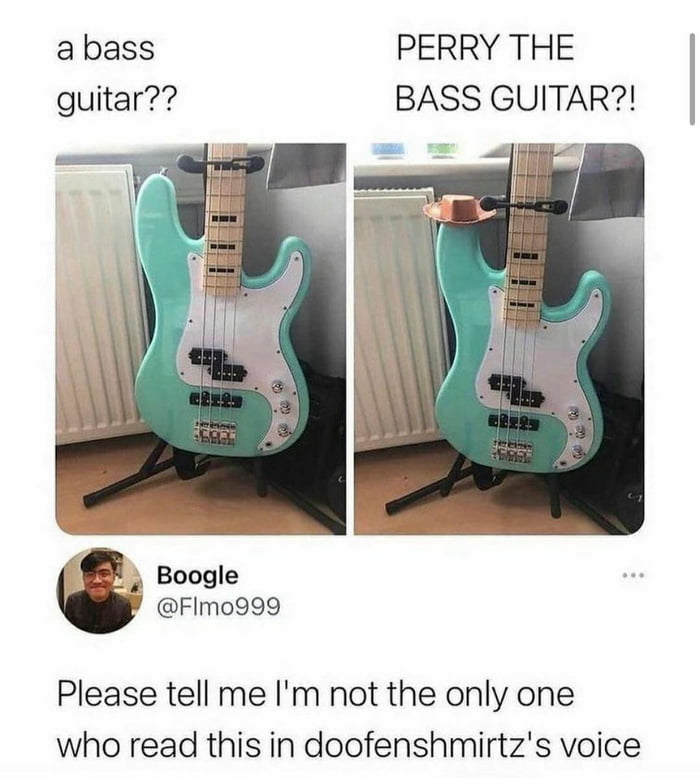
Where is `floor`? This screenshot has width=700, height=778. floor is located at coordinates (262, 513).